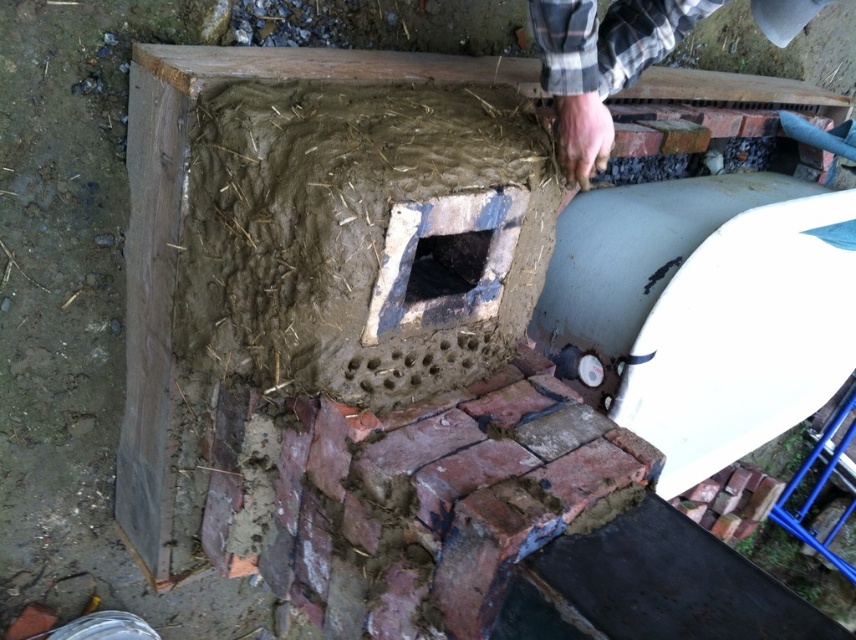
Is plaid flannel shirt at upper right to the left of black concrete hole at center from the viewer's perspective?

Incorrect, plaid flannel shirt at upper right is not on the left side of black concrete hole at center.

Can you confirm if plaid flannel shirt at upper right is shorter than black concrete hole at center?

In fact, plaid flannel shirt at upper right may be taller than black concrete hole at center.

Is point (569, 83) more distant than point (378, 275)?

Yes, it is behind point (378, 275).

Identify the location of plaid flannel shirt at upper right. The width and height of the screenshot is (856, 640). (601, 65).